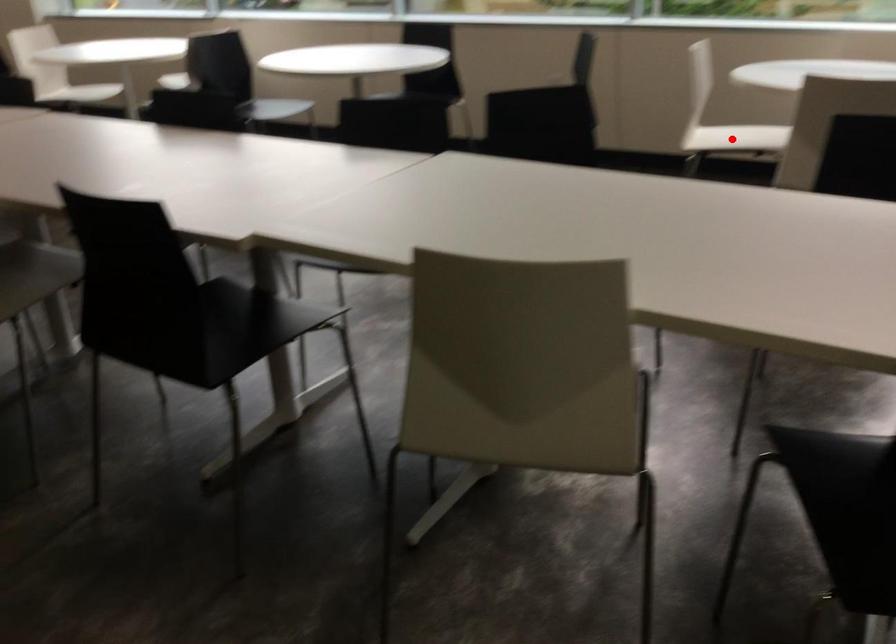
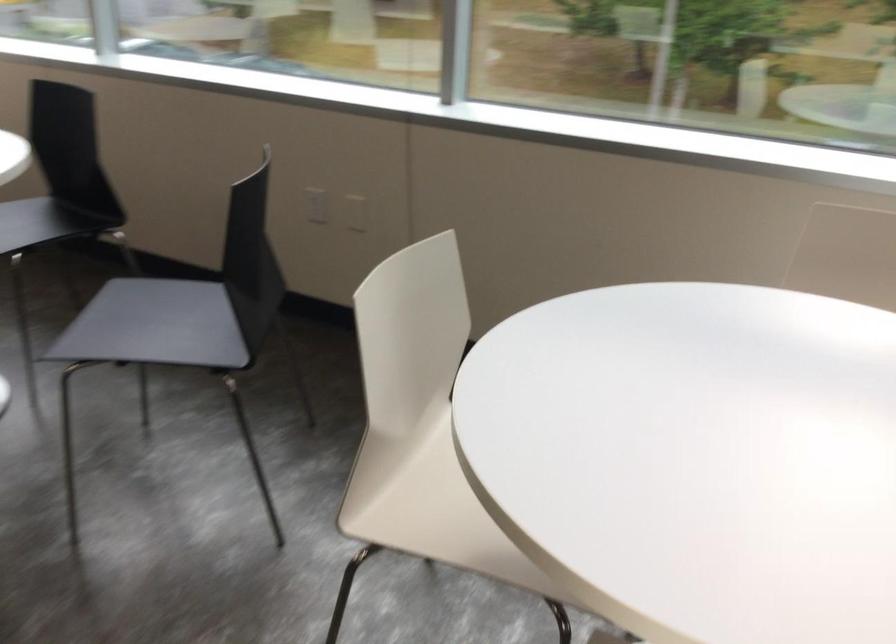
Question: I am providing you with two images of the same scene from different viewpoints. A red point is shown in image1. For the corresponding object point in image2, is it positioned nearer or farther from the camera?

Choices:
 (A) Nearer
 (B) Farther

Answer: (A)